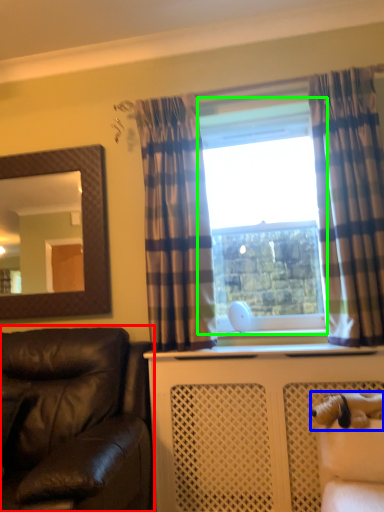
Question: Estimate the real-world distances between objects in this image. Which object is closer to studio couch (highlighted by a red box), animal (highlighted by a blue box) or window frame (highlighted by a green box)?

Choices:
 (A) animal
 (B) window frame

Answer: (A)